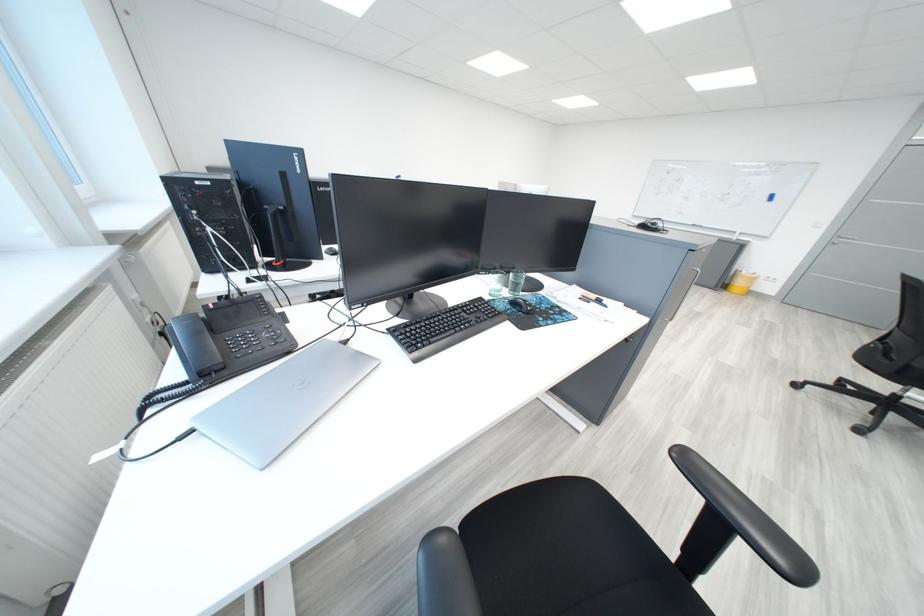
Find where to resting arm the black chair armrest. Please return your answer as a coordinate pair (x, y).

(444, 576)